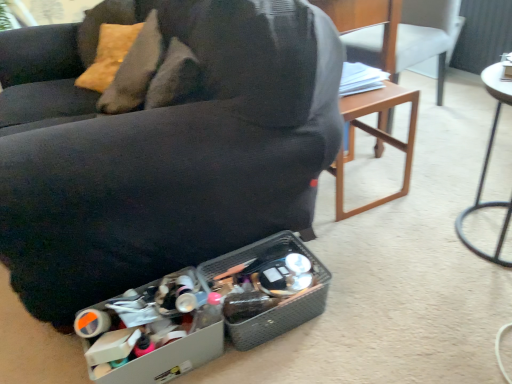
Question: Is matte black couch at center, placed as the 2th chair when sorted from right to left, outside of metallic silver table at right?

Choices:
 (A) no
 (B) yes

Answer: (B)

Question: From the image's perspective, is matte black couch at center, placed as the 2th chair when sorted from right to left, below metallic silver table at right?

Choices:
 (A) yes
 (B) no

Answer: (B)

Question: Does matte black couch at center, placed as the 2th chair when sorted from right to left, have a greater height compared to metallic silver table at right?

Choices:
 (A) yes
 (B) no

Answer: (A)

Question: From a real-world perspective, does matte black couch at center, placed as the first chair when sorted from left to right, stand above metallic silver table at right?

Choices:
 (A) no
 (B) yes

Answer: (B)

Question: Is there a large distance between matte black couch at center, placed as the 2th chair when sorted from right to left, and metallic silver table at right?

Choices:
 (A) no
 (B) yes

Answer: (A)

Question: Does matte black couch at center, placed as the first chair when sorted from left to right, have a larger size compared to metallic silver table at right?

Choices:
 (A) no
 (B) yes

Answer: (B)

Question: Is the surface of matte black couch at center, placed as the 2th chair when sorted from right to left, in direct contact with wooden chair at right, positioned as the first chair in right-to-left order?

Choices:
 (A) no
 (B) yes

Answer: (A)

Question: From a real-world perspective, is matte black couch at center, placed as the 2th chair when sorted from right to left, physically below wooden chair at right, which is counted as the second chair, starting from the left?

Choices:
 (A) yes
 (B) no

Answer: (B)

Question: Is matte black couch at center, placed as the first chair when sorted from left to right, outside of wooden chair at right, positioned as the first chair in right-to-left order?

Choices:
 (A) no
 (B) yes

Answer: (B)

Question: Does matte black couch at center, placed as the 2th chair when sorted from right to left, have a larger size compared to wooden chair at right, positioned as the first chair in right-to-left order?

Choices:
 (A) no
 (B) yes

Answer: (B)

Question: Is matte black couch at center, placed as the first chair when sorted from left to right, behind wooden chair at right, positioned as the first chair in right-to-left order?

Choices:
 (A) no
 (B) yes

Answer: (A)

Question: Is matte black couch at center, placed as the first chair when sorted from left to right, oriented towards wooden chair at right, positioned as the first chair in right-to-left order?

Choices:
 (A) yes
 (B) no

Answer: (B)

Question: Does metallic silver table at right have a smaller size compared to wooden chair at right, which is counted as the second chair, starting from the left?

Choices:
 (A) yes
 (B) no

Answer: (A)